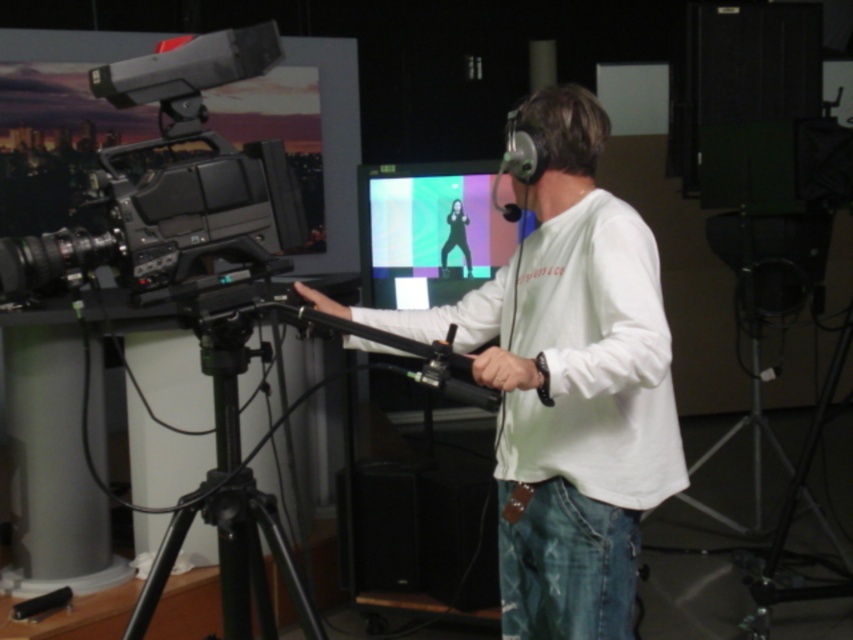
Question: Among these points, which one is nearest to the camera?

Choices:
 (A) (155, 572)
 (B) (567, 465)

Answer: (A)

Question: Can you confirm if matte black camera at left is wider than black metal tripod at center?

Choices:
 (A) no
 (B) yes

Answer: (A)

Question: Which of the following is the farthest from the observer?

Choices:
 (A) (158, 221)
 (B) (178, 499)
 (C) (822, 522)
 (D) (554, 348)

Answer: (C)

Question: Is black metal tripod at left closer to the viewer compared to black metal tripod at center?

Choices:
 (A) yes
 (B) no

Answer: (A)

Question: Considering the real-world distances, which object is closest to the matte plastic monitor at center?

Choices:
 (A) white matte shirt at center
 (B) black metal tripod at center

Answer: (A)

Question: Observing the image, what is the correct spatial positioning of matte plastic monitor at center in reference to black metal tripod at center?

Choices:
 (A) right
 (B) left

Answer: (B)